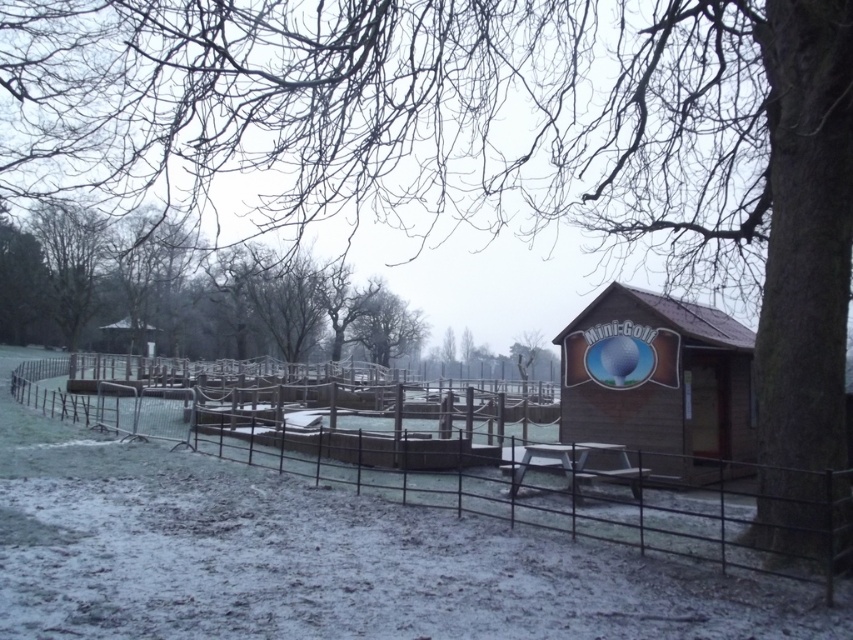
Can you confirm if wooden fence at center is wider than wooden hut at center?

Indeed, wooden fence at center has a greater width compared to wooden hut at center.

Find the location of a particular element. This screenshot has width=853, height=640. wooden fence at center is located at coordinates (521, 496).

Is bare wood fence at left to the left of wooden fence at center from the viewer's perspective?

Correct, you'll find bare wood fence at left to the left of wooden fence at center.

Can you confirm if bare wood fence at left is positioned below wooden fence at center?

No.

Is point (265, 304) closer to camera compared to point (91, 410)?

No, (265, 304) is behind (91, 410).

Identify the location of bare wood fence at left. Image resolution: width=853 pixels, height=640 pixels. (181, 294).

Which of these two, bare wood fence at left or wooden hut at center, stands taller?

Standing taller between the two is bare wood fence at left.

Is bare wood fence at left thinner than wooden hut at center?

In fact, bare wood fence at left might be wider than wooden hut at center.

Does point (392, 301) come closer to viewer compared to point (593, 380)?

No.

Where is `bare wood fence at left`? bare wood fence at left is located at coordinates (181, 294).